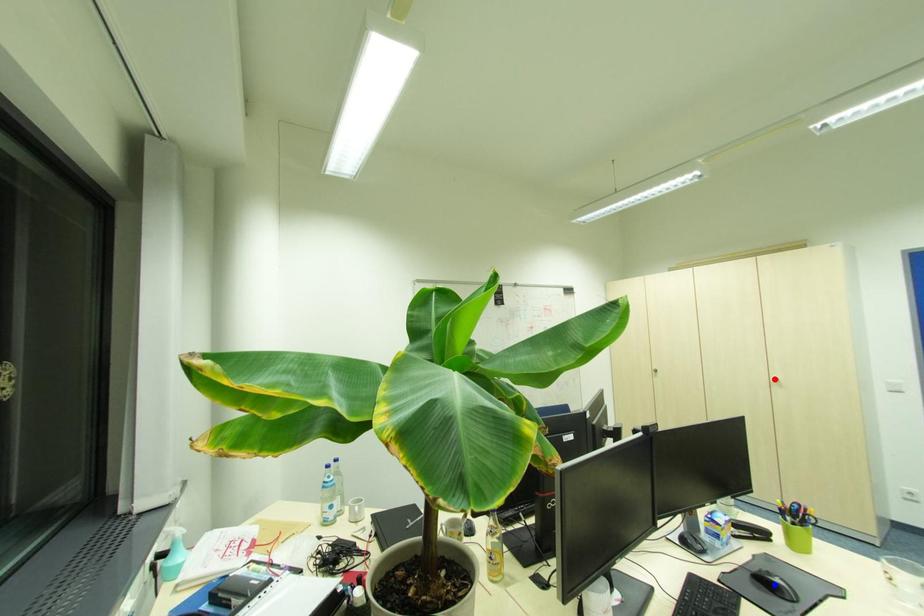
Question: In the image, two points are highlighted. Which point is nearer to the camera? Reply with the corresponding letter.

Choices:
 (A) blue point
 (B) red point

Answer: (A)